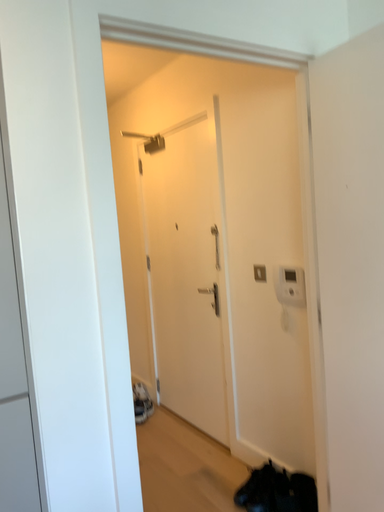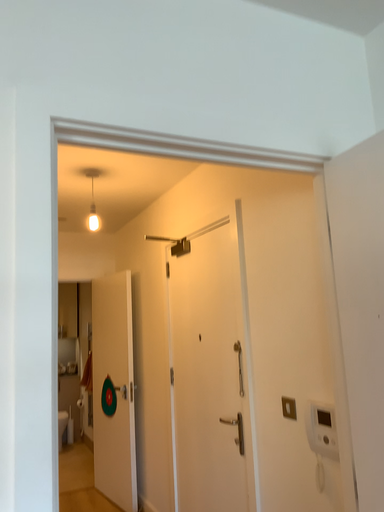
Question: Which way did the camera rotate in the video?

Choices:
 (A) rotated left
 (B) rotated right

Answer: (A)